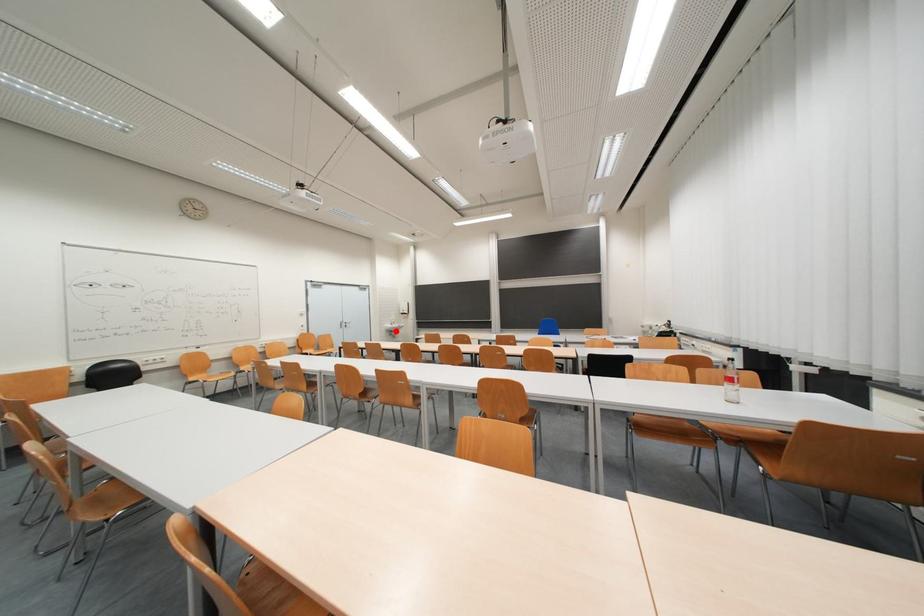
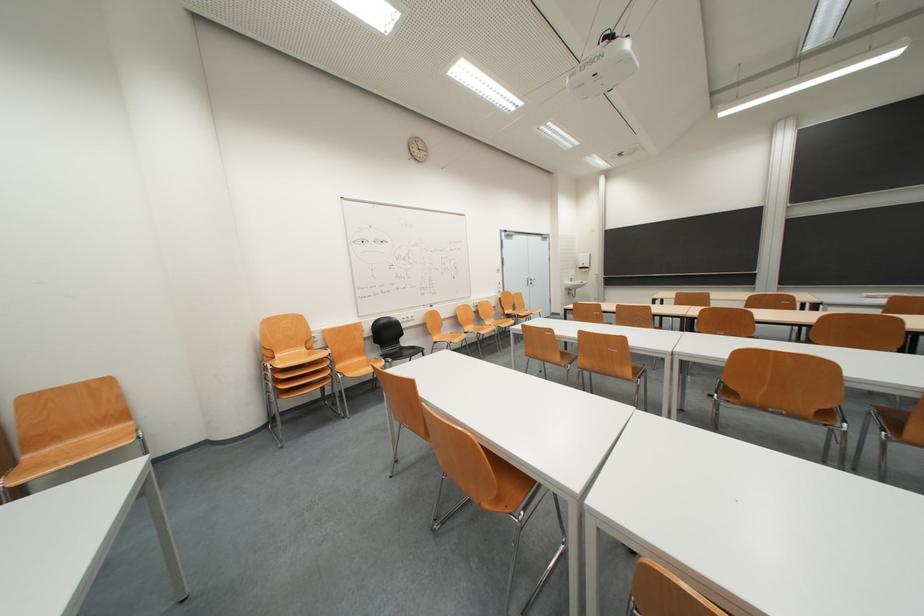
Question: I am providing you with two images of the same scene from different viewpoints. In image1, a red point is highlighted. Considering the same 3D point in image2, which of the following is correct?

Choices:
 (A) It is closer
 (B) It is farther

Answer: (A)